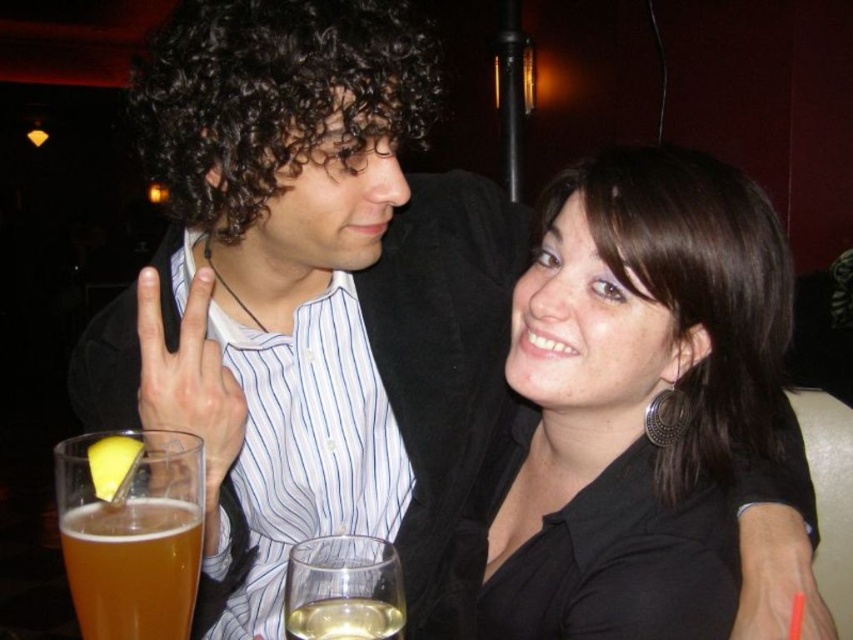
You are a bartender who needs to place a new drink order on the table. The table has two existing glasses. The first glass is at point (x=131, y=531) and the second glass is at point 0.672, 0.345. You want to place the new drink between them. Where should you place it?

The new drink should be placed between the translucent glass at lower left and the second glass at point 0.672, 0.345. Since the first glass is at (x=131, y=531) and the second at 0.672, 0.345, the midpoint between them would be approximately at coordinates 0.7515, 0.25. However, since the exact placement depends on the table layout, the safest position is halfway between the two existing glasses.

You are a photographer trying to capture the scene. You want to focus on the black matte shirt at center and the translucent glass at lower left. Based on their positions, which object should you adjust your camera to focus on first if you want to ensure both are in the frame without moving the camera?

The black matte shirt at center is to the right of the translucent glass at lower left, so you should focus on the translucent glass at lower left first to ensure both are in the frame without moving the camera.